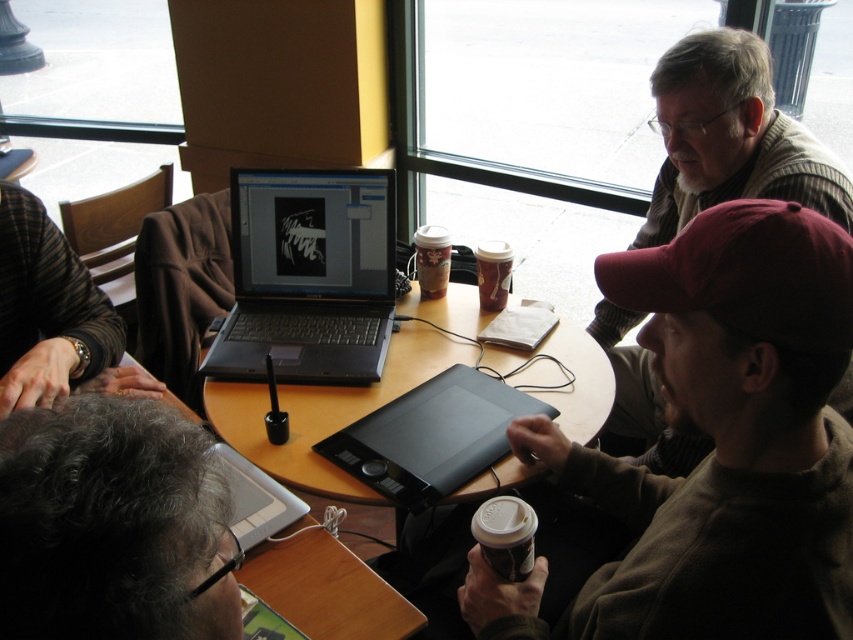
You are a customer in the cafe and want to place an order. You need to slide your phone from the black plastic laptop at center to the black matte graphic tablet at center on the table. Is the tablet located below the laptop so you can slide it directly without lifting?

The black plastic laptop at center is located above the black matte graphic tablet at center, so yes, you can slide the phone directly from the black plastic laptop at center to the black matte graphic tablet at center since the tablet is positioned below the laptop on the table.

You are a barista carrying a tray of drinks and need to place it on the wooden table at center. However, there is a brown fuzzy sweater at center on the table. Can you place the tray there without moving the sweater?

The brown fuzzy sweater at center is located below the wooden table at center, so it is not on the table surface. You can safely place the tray on the wooden table at center without moving the sweater.